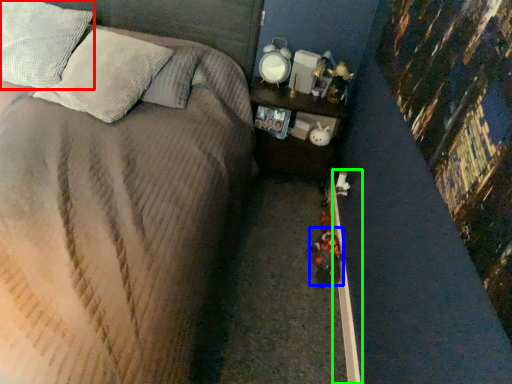
Question: Which object is positioned farthest from pillow (highlighted by a red box)? Select from toy (highlighted by a blue box) and curb (highlighted by a green box).

Choices:
 (A) toy
 (B) curb

Answer: (A)